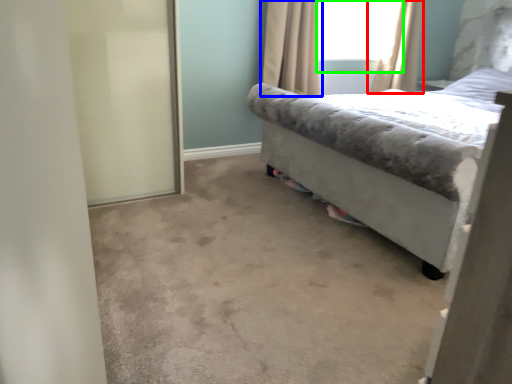
Question: Estimate the real-world distances between objects in this image. Which object is closer to curtain (highlighted by a red box), curtain (highlighted by a blue box) or window screen (highlighted by a green box)?

Choices:
 (A) curtain
 (B) window screen

Answer: (B)